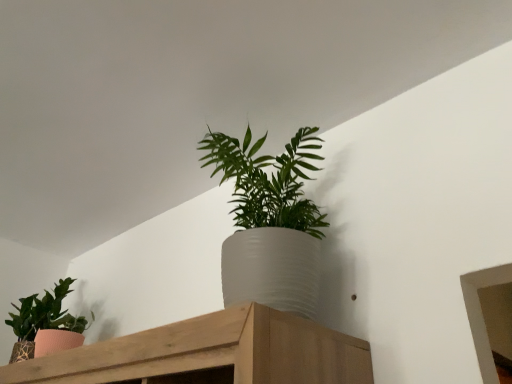
Question: From the image's perspective, is textured pink pot at left, the 1th houseplant viewed from the left, located beneath white textured pot at center, which ranks as the second houseplant in left-to-right order?

Choices:
 (A) no
 (B) yes

Answer: (B)

Question: From a real-world perspective, is textured pink pot at left, the 1th houseplant viewed from the left, positioned over white textured pot at center, the first houseplant from the front, based on gravity?

Choices:
 (A) no
 (B) yes

Answer: (A)

Question: Can you confirm if textured pink pot at left, the 1th houseplant viewed from the left, is positioned to the right of white textured pot at center, positioned as the 2th houseplant in back-to-front order?

Choices:
 (A) no
 (B) yes

Answer: (A)

Question: Does textured pink pot at left, placed as the 1th houseplant when sorted from back to front, have a larger size compared to white textured pot at center, the first houseplant from the front?

Choices:
 (A) no
 (B) yes

Answer: (A)

Question: Does textured pink pot at left, the 1th houseplant viewed from the left, turn towards white textured pot at center, the first houseplant from the front?

Choices:
 (A) yes
 (B) no

Answer: (B)

Question: From a real-world perspective, is textured pink pot at left, placed as the 2th houseplant when sorted from right to left, under white textured pot at center, which ranks as the second houseplant in left-to-right order?

Choices:
 (A) no
 (B) yes

Answer: (B)

Question: Is white textured pot at center, which is the first houseplant in right-to-left order, with textured pink pot at left, placed as the 2th houseplant when sorted from right to left?

Choices:
 (A) no
 (B) yes

Answer: (A)

Question: Is white textured pot at center, positioned as the 2th houseplant in back-to-front order, positioned behind textured pink pot at left, the second houseplant viewed from the front?

Choices:
 (A) no
 (B) yes

Answer: (A)

Question: Is white textured pot at center, positioned as the 2th houseplant in back-to-front order, at the left side of textured pink pot at left, placed as the 1th houseplant when sorted from back to front?

Choices:
 (A) yes
 (B) no

Answer: (B)

Question: Can you confirm if white textured pot at center, which ranks as the second houseplant in left-to-right order, is smaller than textured pink pot at left, the second houseplant viewed from the front?

Choices:
 (A) yes
 (B) no

Answer: (B)

Question: Is white textured pot at center, which is the first houseplant in right-to-left order, not close to textured pink pot at left, placed as the 2th houseplant when sorted from right to left?

Choices:
 (A) no
 (B) yes

Answer: (A)

Question: From the image's perspective, is white textured pot at center, which ranks as the second houseplant in left-to-right order, below textured pink pot at left, the 1th houseplant viewed from the left?

Choices:
 (A) yes
 (B) no

Answer: (B)

Question: Is textured pink pot at left, the second houseplant viewed from the front, inside or outside of white textured pot at center, positioned as the 2th houseplant in back-to-front order?

Choices:
 (A) inside
 (B) outside

Answer: (B)